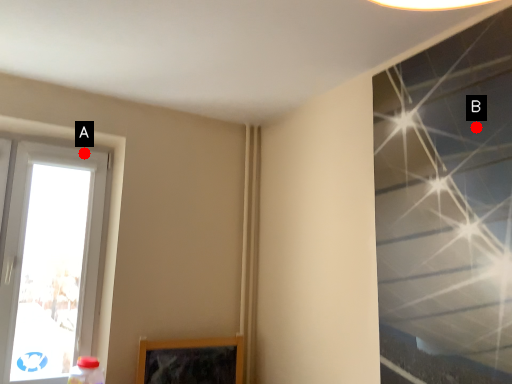
Question: Two points are circled on the image, labeled by A and B beside each circle. Which point is closer to the camera taking this photo?

Choices:
 (A) A is closer
 (B) B is closer

Answer: (B)